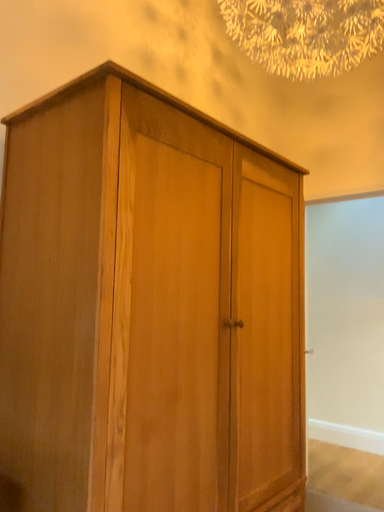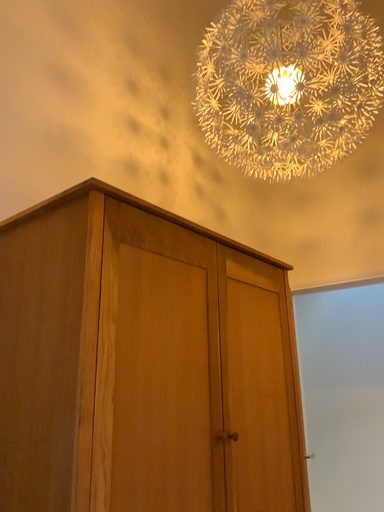
Question: How did the camera likely rotate when shooting the video?

Choices:
 (A) rotated downward
 (B) rotated upward

Answer: (B)